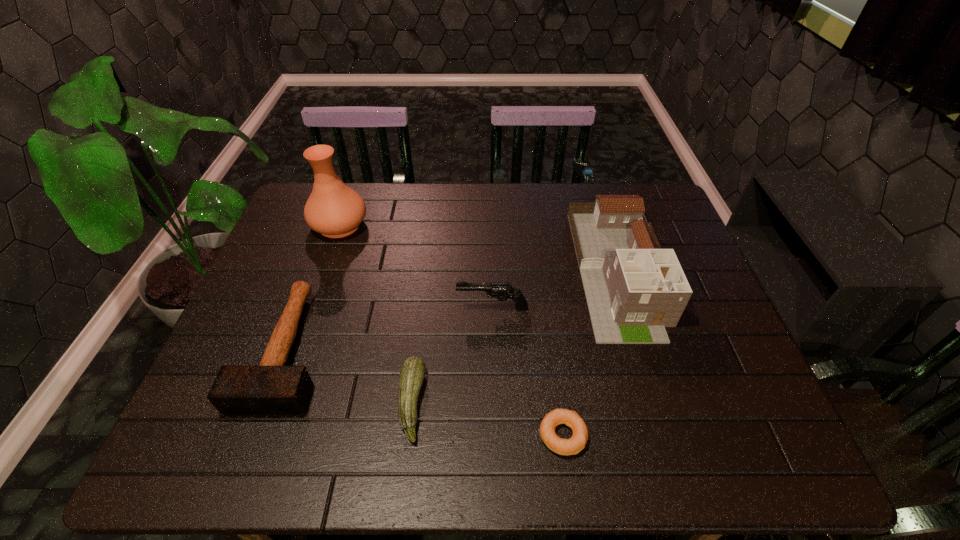
Identify which object is located as the third nearest to the tallest object. Please provide its 2D coordinates. Your answer should be formatted as a tuple, i.e. [(x, y)], where the tuple contains the x and y coordinates of a point satisfying the conditions above.

[(412, 373)]

You are a GUI agent. You are given a task and a screenshot of the screen. Output one action in this format:
    pyautogui.click(x=<x>, y=<y>)
    Task: Click on the object identified as the fifth closest to the tallest object
    The width and height of the screenshot is (960, 540).
    Given the screenshot: What is the action you would take?
    pyautogui.click(x=572, y=446)

This screenshot has width=960, height=540. Find the location of `free spot that satisfies the following two spatial constraints: 1. at the main entrance of the second tallest object; 2. at the stem end of the third object from left to right`. free spot that satisfies the following two spatial constraints: 1. at the main entrance of the second tallest object; 2. at the stem end of the third object from left to right is located at coordinates (658, 402).

Find the location of a particular element. The width and height of the screenshot is (960, 540). free location that satisfies the following two spatial constraints: 1. at the end of the barrel of the bagel; 2. on the left side of the fourth shortest object is located at coordinates (495, 435).

The width and height of the screenshot is (960, 540). In order to click on vacant space that satisfies the following two spatial constraints: 1. at the main entrance of the fifth shortest object; 2. at the end of the barrel of the fourth shortest object in this screenshot , I will do `click(629, 308)`.

I want to click on vacant position in the image that satisfies the following two spatial constraints: 1. on the hammer head face of the bagel; 2. on the left side of the fourth tallest object, so click(x=256, y=435).

Where is `vacant area in the image that satisfies the following two spatial constraints: 1. on the hammer head face of the shortest object; 2. on the right side of the third shortest object`? This screenshot has width=960, height=540. vacant area in the image that satisfies the following two spatial constraints: 1. on the hammer head face of the shortest object; 2. on the right side of the third shortest object is located at coordinates (256, 435).

Identify the location of free spot that satisfies the following two spatial constraints: 1. at the main entrance of the dollhouse; 2. at the stem end of the fifth tallest object. The height and width of the screenshot is (540, 960). (658, 402).